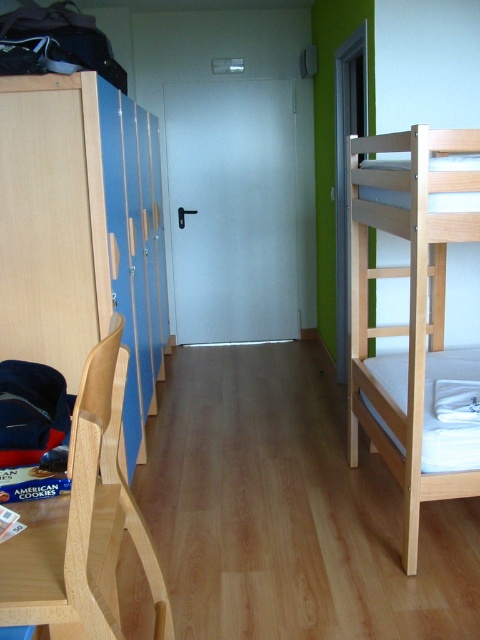
Which of these two, natural wood bunk bed at right or light wood/wooden chair at left, stands shorter?

With less height is light wood/wooden chair at left.

Does natural wood bunk bed at right appear on the left side of light wood/wooden chair at left?

Incorrect, natural wood bunk bed at right is not on the left side of light wood/wooden chair at left.

Does point (391, 227) come farther from viewer compared to point (80, 529)?

Yes, point (391, 227) is farther from viewer.

Where is `natural wood bunk bed at right`? natural wood bunk bed at right is located at coordinates (414, 314).

Between point (31, 180) and point (465, 442), which one is positioned in front?

Positioned in front is point (465, 442).

Is blue matte locker at left to the left of natural wood bunk bed at right from the viewer's perspective?

Correct, you'll find blue matte locker at left to the left of natural wood bunk bed at right.

Between point (7, 81) and point (436, 145), which one is positioned in front?

Positioned in front is point (436, 145).

The image size is (480, 640). What are the coordinates of `blue matte locker at left` in the screenshot? It's located at (67, 227).

Is blue matte locker at left smaller than light wood/wooden chair at left?

No.

Between blue matte locker at left and light wood/wooden chair at left, which one is positioned lower?

light wood/wooden chair at left is lower down.

Who is more forward, (x=124, y=452) or (x=28, y=547)?

Positioned in front is point (x=28, y=547).

I want to click on blue matte locker at left, so click(67, 227).